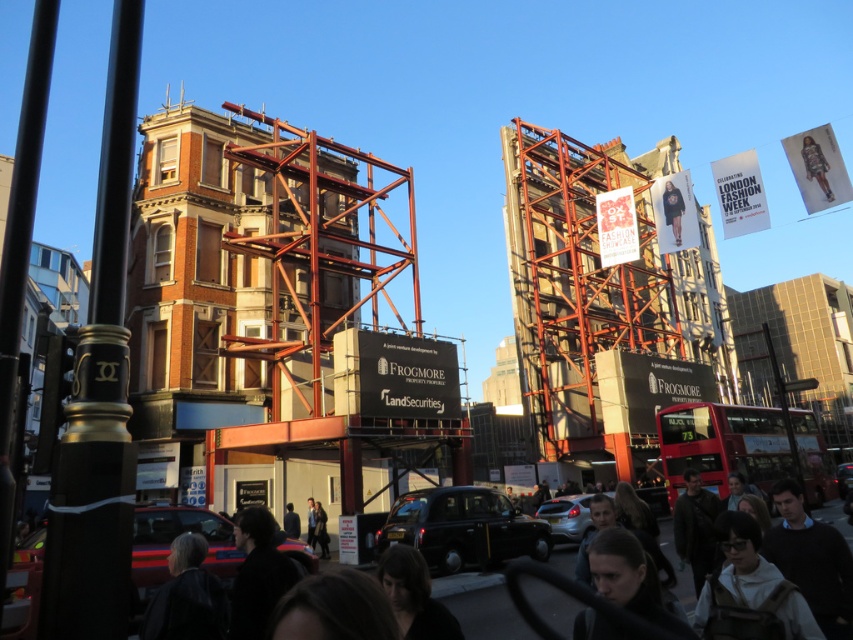
You are a photographer standing on the street and want to take a picture of the red metallic bus at center without the dark hair at lower center blocking the view. How should you adjust your camera angle?

The red metallic bus at center is located above dark hair at lower center, so you can angle your camera upwards to capture the bus while avoiding the obstruction of the dark hair at lower center.

You are a photographer standing on the street in London. You notice a black polished metal pole at left and a person with dark hair at lower center. Which object is taller from your viewpoint?

The black polished metal pole at left is taller than the dark hair at lower center.

You are a photographer standing on the street in this scene. You want to take a photo that includes both the black polished metal pole at left and the red metallic bus at center. Which object will appear taller in your photo?

The black polished metal pole at left will appear taller in the photo because it is taller than the red metallic bus at center.